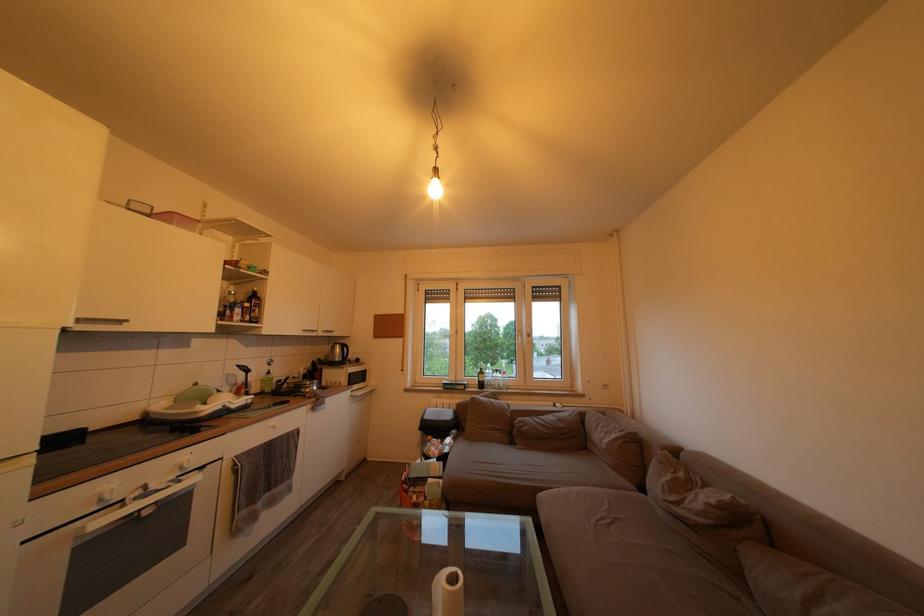
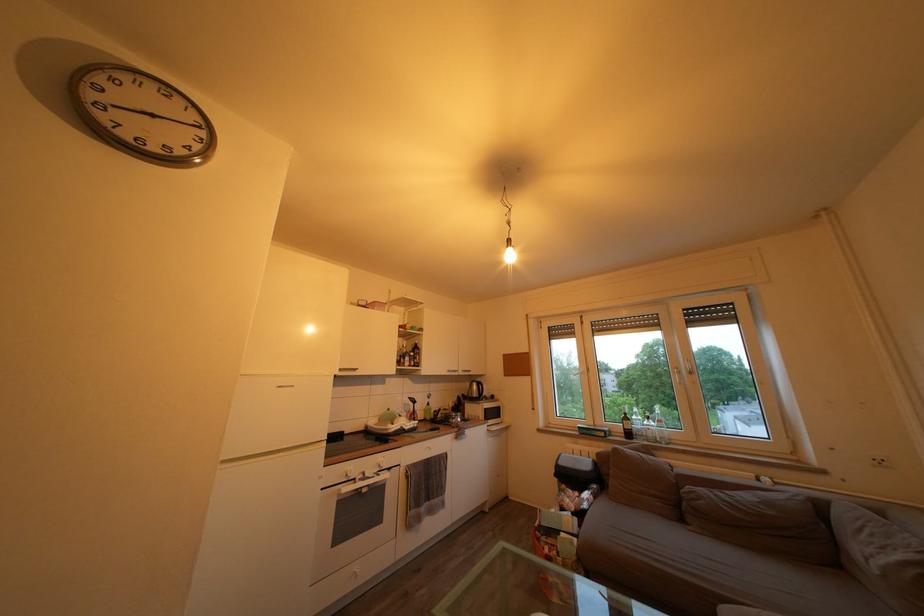
In the second image, find the point that corresponds to the point at 568,426 in the first image.

(774, 509)